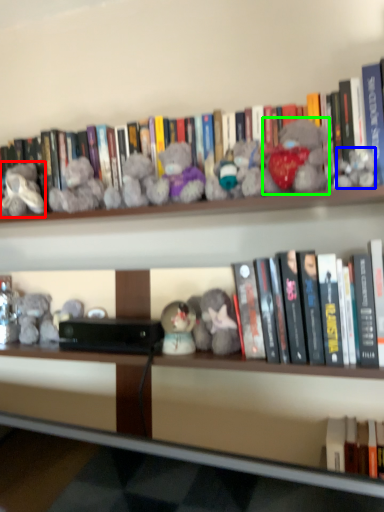
Question: Which is farther away from toy (highlighted by a red box)? toy (highlighted by a blue box) or toy (highlighted by a green box)?

Choices:
 (A) toy
 (B) toy

Answer: (A)